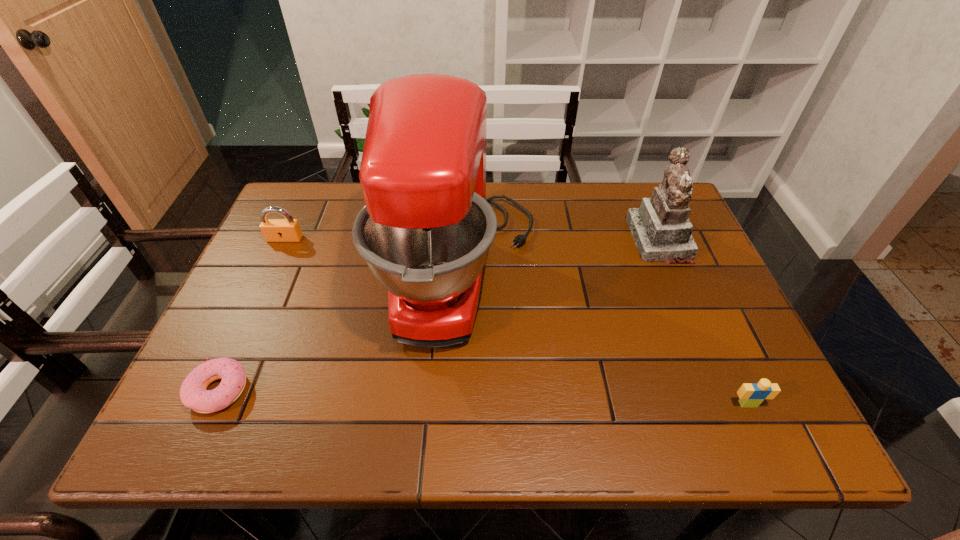
At what (x,y) coordinates should I click in order to perform the action: click on object located at the near left corner. Please return your answer as a coordinate pair (x, y). Image resolution: width=960 pixels, height=540 pixels. Looking at the image, I should click on (193, 393).

You are a GUI agent. You are given a task and a screenshot of the screen. Output one action in this format:
    pyautogui.click(x=<x>, y=<y>)
    Task: Click on the object at the far right corner
    This screenshot has height=540, width=960.
    Given the screenshot: What is the action you would take?
    pyautogui.click(x=661, y=229)

You are a GUI agent. You are given a task and a screenshot of the screen. Output one action in this format:
    pyautogui.click(x=<x>, y=<y>)
    Task: Click on the object that is at the near right corner
    The width and height of the screenshot is (960, 540).
    Given the screenshot: What is the action you would take?
    pyautogui.click(x=752, y=395)

I want to click on free region at the far edge, so click(573, 211).

You are a GUI agent. You are given a task and a screenshot of the screen. Output one action in this format:
    pyautogui.click(x=<x>, y=<y>)
    Task: Click on the free space at the near edge of the desktop
    The height and width of the screenshot is (540, 960).
    Given the screenshot: What is the action you would take?
    pyautogui.click(x=670, y=403)

Locate an element on the screen. This screenshot has height=540, width=960. vacant space at the left edge is located at coordinates (262, 332).

This screenshot has width=960, height=540. In the image, there is a desktop. Identify the location of vacant area at the right edge. (703, 308).

This screenshot has width=960, height=540. In order to click on vacant space at the far right corner of the desktop in this screenshot , I will do `click(636, 202)`.

What are the coordinates of `free space at the near right corner of the desktop` in the screenshot? It's located at (766, 437).

The image size is (960, 540). Find the location of `free space between the fourth shortest object and the Lego`. free space between the fourth shortest object and the Lego is located at coordinates (704, 322).